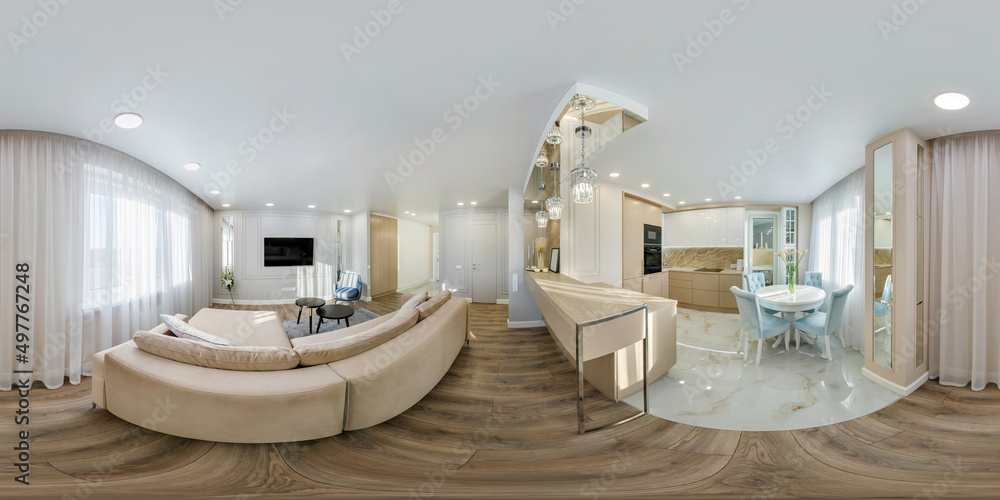
Find the location of a particular element. Image resolution: width=1000 pixels, height=500 pixels. chair is located at coordinates (757, 314), (759, 280), (812, 277), (835, 319), (351, 291).